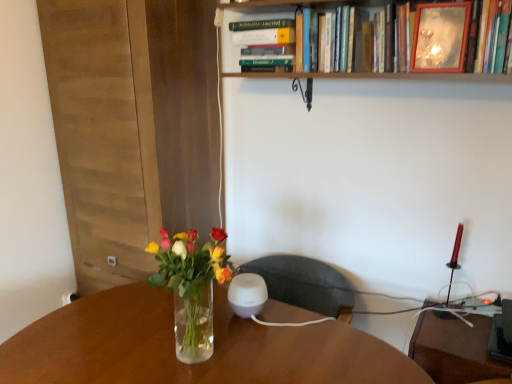
Question: Can you confirm if wooden frame mirror at upper center, positioned as the 2th book in left-to-right order, is shorter than translucent glass vase at center?

Choices:
 (A) yes
 (B) no

Answer: (A)

Question: Considering the relative sizes of wooden frame mirror at upper center, positioned as the 2th book in left-to-right order, and translucent glass vase at center in the image provided, is wooden frame mirror at upper center, positioned as the 2th book in left-to-right order, bigger than translucent glass vase at center?

Choices:
 (A) no
 (B) yes

Answer: (B)

Question: Does wooden frame mirror at upper center, positioned as the 2th book in left-to-right order, come in front of translucent glass vase at center?

Choices:
 (A) yes
 (B) no

Answer: (B)

Question: Considering the relative positions of wooden frame mirror at upper center, positioned as the 2th book in left-to-right order, and translucent glass vase at center in the image provided, is wooden frame mirror at upper center, positioned as the 2th book in left-to-right order, behind translucent glass vase at center?

Choices:
 (A) no
 (B) yes

Answer: (B)

Question: From the image's perspective, is wooden frame mirror at upper center, positioned as the 2th book in left-to-right order, over translucent glass vase at center?

Choices:
 (A) yes
 (B) no

Answer: (A)

Question: Considering the positions of wooden frame mirror at upper center, the first book positioned from the right, and hardcover book at upper center, the second book viewed from the right, in the image, is wooden frame mirror at upper center, the first book positioned from the right, wider or thinner than hardcover book at upper center, the second book viewed from the right,?

Choices:
 (A) thin
 (B) wide

Answer: (A)

Question: Looking at the image, does wooden frame mirror at upper center, the first book positioned from the right, seem bigger or smaller compared to hardcover book at upper center, which ranks as the 1th book in left-to-right order?

Choices:
 (A) big
 (B) small

Answer: (A)

Question: Considering the positions of wooden frame mirror at upper center, positioned as the 2th book in left-to-right order, and hardcover book at upper center, the second book viewed from the right, in the image, is wooden frame mirror at upper center, positioned as the 2th book in left-to-right order, taller or shorter than hardcover book at upper center, the second book viewed from the right,?

Choices:
 (A) short
 (B) tall

Answer: (B)

Question: From a real-world perspective, is wooden frame mirror at upper center, the first book positioned from the right, physically located above or below hardcover book at upper center, the second book viewed from the right?

Choices:
 (A) above
 (B) below

Answer: (A)

Question: Is translucent glass vase at center wider or thinner than hardcover book at upper center, the second book viewed from the right?

Choices:
 (A) thin
 (B) wide

Answer: (A)

Question: From the image's perspective, is translucent glass vase at center above or below hardcover book at upper center, which ranks as the 1th book in left-to-right order?

Choices:
 (A) below
 (B) above

Answer: (A)

Question: From a real-world perspective, relative to hardcover book at upper center, which ranks as the 1th book in left-to-right order, is translucent glass vase at center vertically above or below?

Choices:
 (A) below
 (B) above

Answer: (A)

Question: In the image, is translucent glass vase at center positioned in front of or behind hardcover book at upper center, which ranks as the 1th book in left-to-right order?

Choices:
 (A) behind
 (B) front

Answer: (B)

Question: In terms of width, does hardcover book at upper center, which ranks as the 1th book in left-to-right order, look wider or thinner when compared to wooden picture frame at upper right?

Choices:
 (A) thin
 (B) wide

Answer: (B)

Question: Considering the relative positions of hardcover book at upper center, the second book viewed from the right, and wooden picture frame at upper right in the image provided, is hardcover book at upper center, the second book viewed from the right, to the left or to the right of wooden picture frame at upper right?

Choices:
 (A) right
 (B) left

Answer: (B)